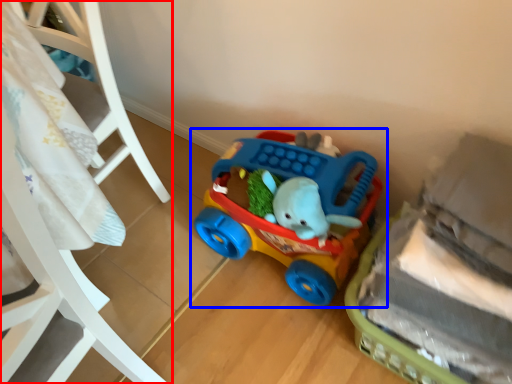
Question: Which object is further to the camera taking this photo, furniture (highlighted by a red box) or toy (highlighted by a blue box)?

Choices:
 (A) furniture
 (B) toy

Answer: (B)